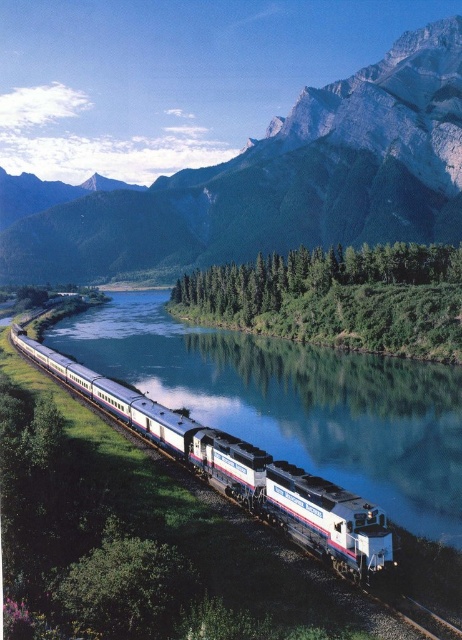
You are standing at the point labeled as point (x=356, y=131) in the image. A train is approaching along the tracks. If the train is currently 354.45 meters away from you, will it pass directly in front of you or behind you?

The point labeled point (x=356, y=131) is 354.45 meters away from the viewer. Since the train is approaching along the tracks, it will pass directly in front of you as you are positioned at the point where the train is approaching.

You are an observer standing at the train station looking at the rugged granite mountain at upper center and the green leafy trees at center. Which object appears wider from your perspective?

The rugged granite mountain at upper center appears wider than the green leafy trees at center because its width is larger.